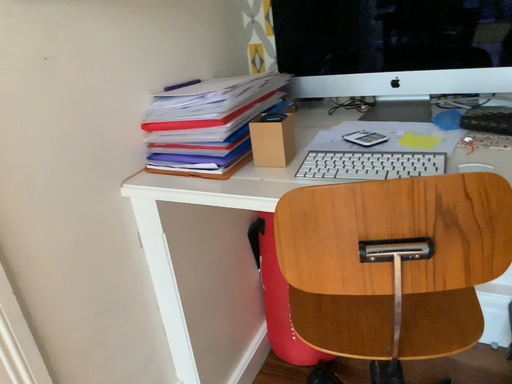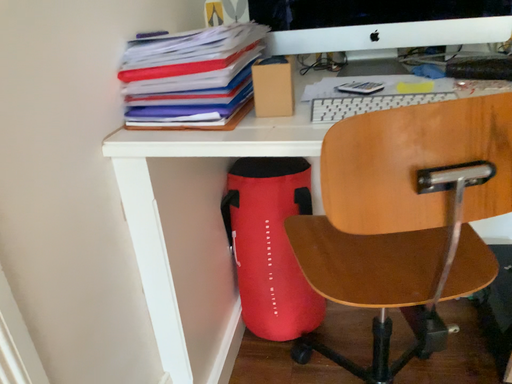
Question: How did the camera likely rotate when shooting the video?

Choices:
 (A) rotated left
 (B) rotated right

Answer: (B)